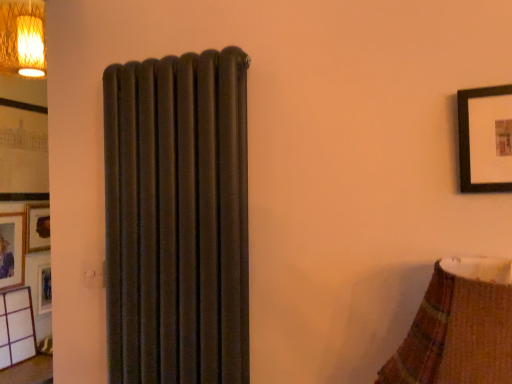
Question: Considering the positions of matte black picture frame at left, the first picture frame positioned from the top, and matte wooden picture frame at left, the 1th picture frame positioned from the bottom, in the image, is matte black picture frame at left, the first picture frame positioned from the top, taller or shorter than matte wooden picture frame at left, the 1th picture frame positioned from the bottom,?

Choices:
 (A) short
 (B) tall

Answer: (B)

Question: In terms of width, does matte black picture frame at left, the first picture frame positioned from the top, look wider or thinner when compared to matte wooden picture frame at left, the 1th picture frame positioned from the bottom?

Choices:
 (A) wide
 (B) thin

Answer: (A)

Question: Based on their sizes in the image, would you say matte black picture frame at left, the first picture frame positioned from the top, is bigger or smaller than matte wooden picture frame at left, the 1th picture frame positioned from the bottom?

Choices:
 (A) small
 (B) big

Answer: (B)

Question: From a real-world perspective, is matte wooden picture frame at left, the 1th picture frame positioned from the bottom, physically located above or below matte black picture frame at left, arranged as the 2th picture frame when ordered from the bottom?

Choices:
 (A) above
 (B) below

Answer: (B)

Question: From the image's perspective, is matte wooden picture frame at left, the 1th picture frame positioned from the bottom, above or below matte black picture frame at left, the first picture frame positioned from the top?

Choices:
 (A) below
 (B) above

Answer: (A)

Question: Considering the positions of point (13, 244) and point (1, 163), is point (13, 244) closer or farther from the camera than point (1, 163)?

Choices:
 (A) closer
 (B) farther

Answer: (B)

Question: In terms of size, does matte wooden picture frame at left, marked as the second picture frame in a top-to-bottom arrangement, appear bigger or smaller than matte black picture frame at left, the first picture frame positioned from the top?

Choices:
 (A) big
 (B) small

Answer: (B)